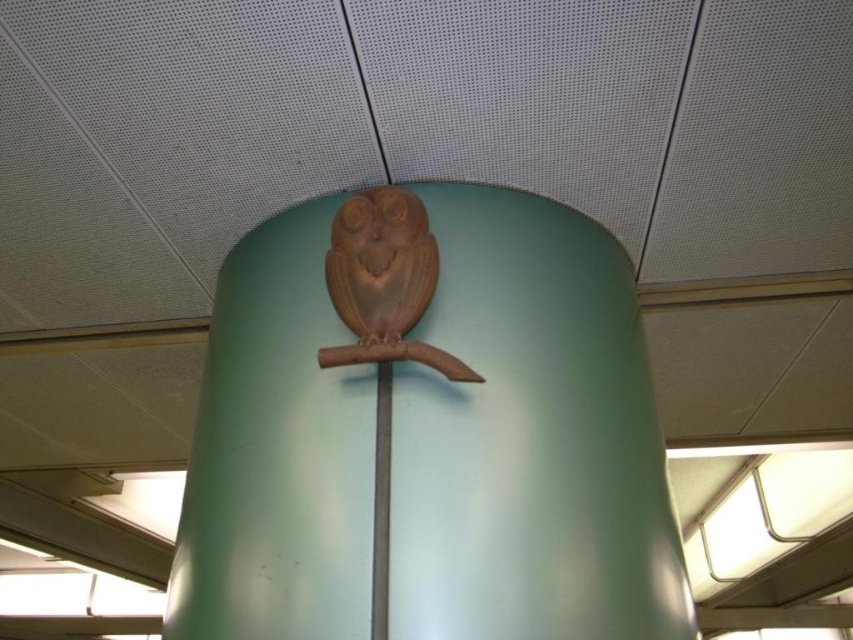
You are an interior designer assessing the ceiling fixtures in a room. You notice two owls on the cylindrical structure at center. Which owl, the matte wood owl at center or the wooden owl at center, is taller?

The matte wood owl at center is taller than the wooden owl at center.

You are standing in a large office space and notice the matte wood owl at center on a column. If you want to touch the owl without moving your feet, can you reach it? Assume your outstretched hand can reach up to 60 inches from the floor.

The matte wood owl at center is 37.71 inches away from the viewer. Since your hand can reach up to 60 inches, which is higher than 37.71 inches, you can reach the matte wood owl at center without moving your feet.